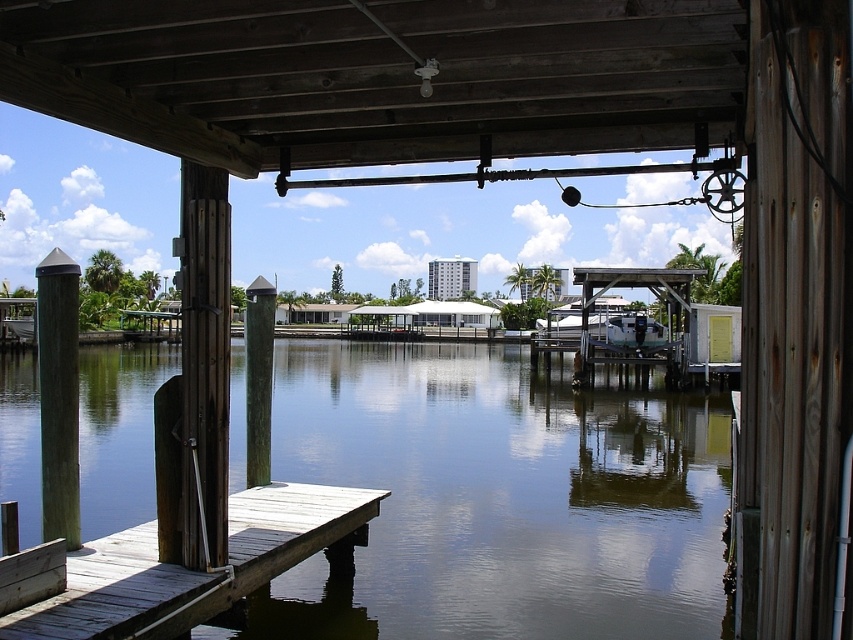
Where is `greenish-gray water at center`? This screenshot has height=640, width=853. greenish-gray water at center is located at coordinates point(497,499).

Is greenish-gray water at center shorter than brown wood post at center?

Yes.

Is point (706, 497) farther from camera compared to point (198, 380)?

Yes, it is behind point (198, 380).

Where is `greenish-gray water at center`? The height and width of the screenshot is (640, 853). greenish-gray water at center is located at coordinates (497, 499).

Does greenish-gray water at center have a smaller size compared to wooden planks at lower left?

No, greenish-gray water at center is not smaller than wooden planks at lower left.

The height and width of the screenshot is (640, 853). I want to click on greenish-gray water at center, so click(497, 499).

Does brown wood post at center have a greater height compared to green wood post at left?

Incorrect, brown wood post at center's height is not larger of green wood post at left's.

Is point (181, 177) more distant than point (50, 364)?

No, it is in front of (50, 364).

This screenshot has width=853, height=640. I want to click on brown wood post at center, so click(204, 360).